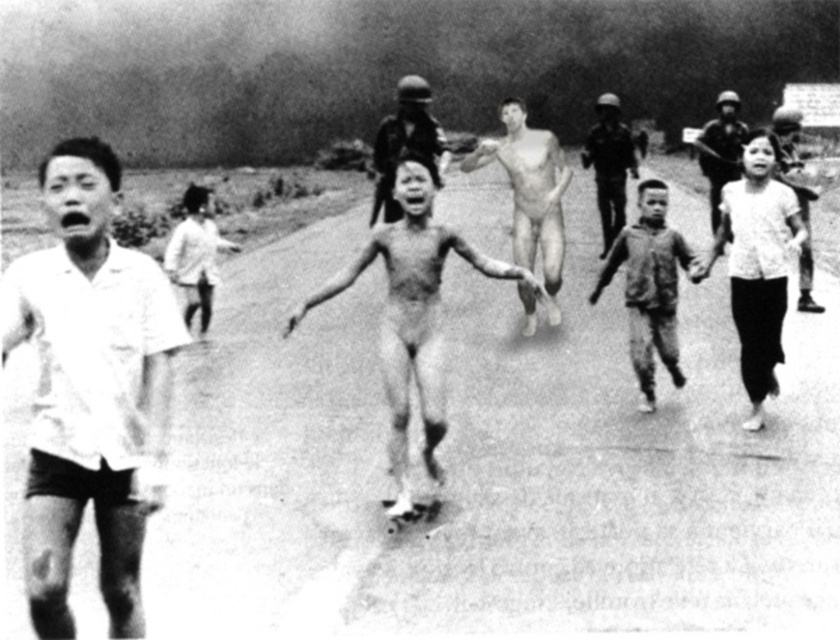
Question: Which point is farther from the camera taking this photo?

Choices:
 (A) (718, 104)
 (B) (211, 250)
 (C) (413, 280)
 (D) (669, 241)

Answer: (A)

Question: Can you confirm if white matte shirt at left is smaller than skinny nude man at center?

Choices:
 (A) no
 (B) yes

Answer: (B)

Question: Does white textured shirt at right appear on the left side of metallic helmet at center?

Choices:
 (A) no
 (B) yes

Answer: (B)

Question: Which point is farther from the camera taking this photo?

Choices:
 (A) (187, 248)
 (B) (72, 490)

Answer: (A)

Question: Can you confirm if metallic helmet at upper center is positioned to the left of matte black helmet at upper center?

Choices:
 (A) no
 (B) yes

Answer: (B)

Question: Among these objects, which one is farthest from the camera?

Choices:
 (A) skinny nude man at center
 (B) metallic helmet at center

Answer: (B)